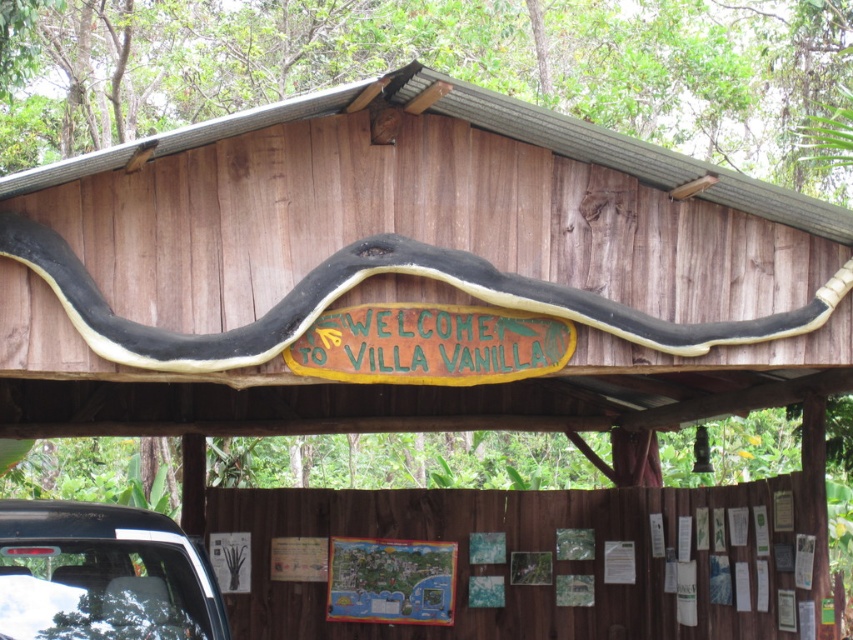
You are a visitor arriving at Villa Vanilla and see the black rubber snake at center and the white glossy car at lower left. Which object is positioned more to the right side of the entrance?

The black rubber snake at center is positioned more to the right side of the entrance compared to the white glossy car at lower left.

You are a visitor arriving at Villa Vanilla and see the black rubber snake at center and the white glossy car at lower left. Which object is located higher up in the scene?

The black rubber snake at center is positioned over the white glossy car at lower left, so it is higher up in the scene.

You are a visitor arriving at Villa Vanilla and see the white glossy car at lower left and the black rubber snake at center. Which object is closer to you as you approach the entrance?

The black rubber snake at center is closer to you than the white glossy car at lower left because the white glossy car at lower left is behind the black rubber snake at center.